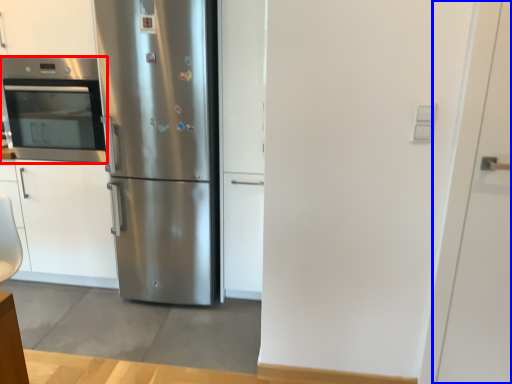
Question: Which object is further to the camera taking this photo, oven (highlighted by a red box) or door (highlighted by a blue box)?

Choices:
 (A) oven
 (B) door

Answer: (A)